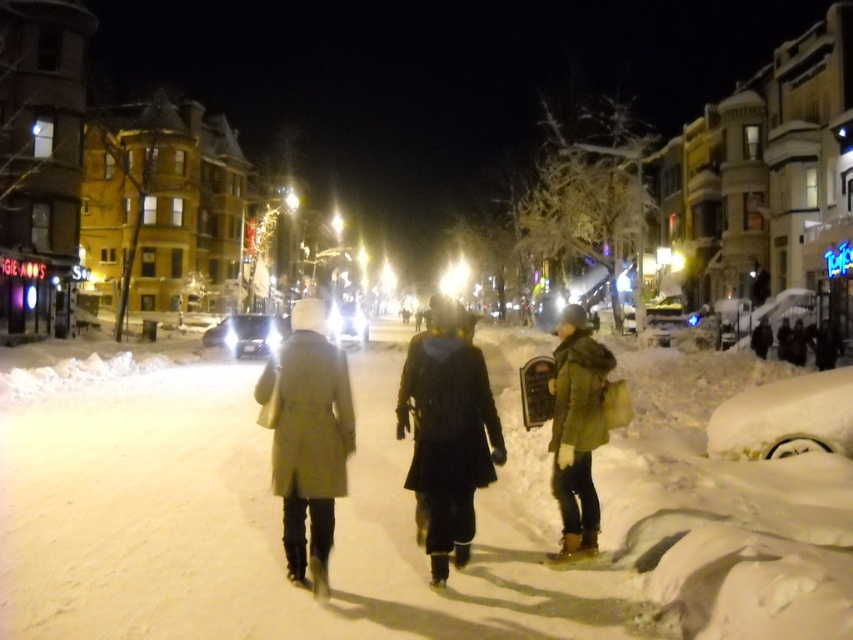
Question: Does light beige coat at center have a larger size compared to green matte coat at center?

Choices:
 (A) no
 (B) yes

Answer: (B)

Question: Where is black matte coat at center located in relation to green matte coat at center in the image?

Choices:
 (A) left
 (B) right

Answer: (A)

Question: Among these points, which one is nearest to the camera?

Choices:
 (A) (461, 333)
 (B) (283, 355)

Answer: (B)

Question: Which of the following is the farthest from the observer?

Choices:
 (A) pos(322,488)
 (B) pos(451,324)

Answer: (B)

Question: Does black matte coat at center appear on the right side of light beige coat at center?

Choices:
 (A) yes
 (B) no

Answer: (A)

Question: Which point is closer to the camera?

Choices:
 (A) light beige coat at center
 (B) black matte coat at center

Answer: (A)